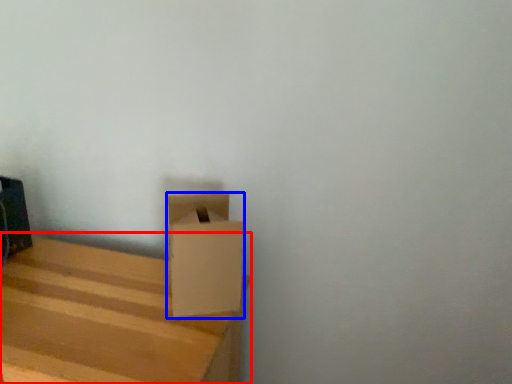
Question: Which object appears closest to the camera in this image, furniture (highlighted by a red box) or cardboard box (highlighted by a blue box)?

Choices:
 (A) furniture
 (B) cardboard box

Answer: (A)